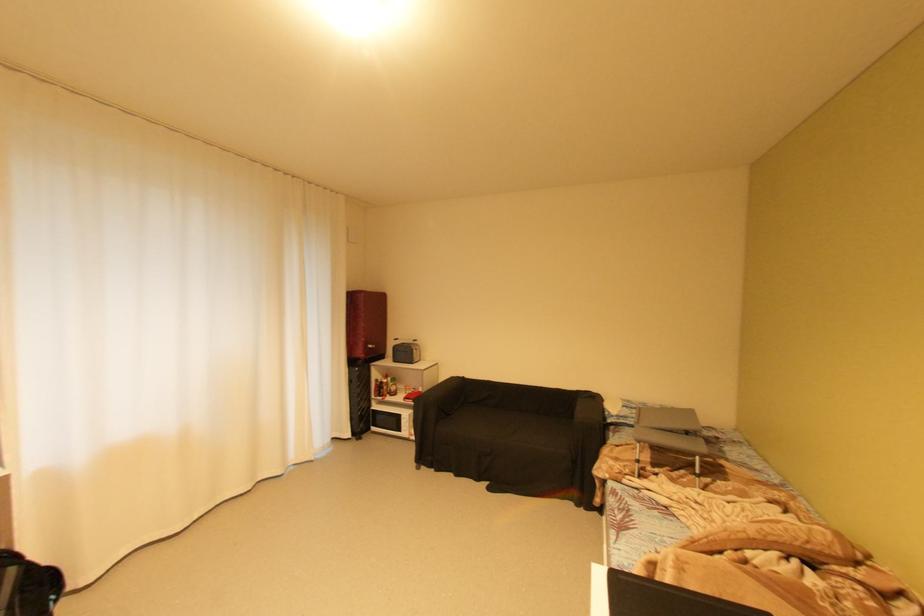
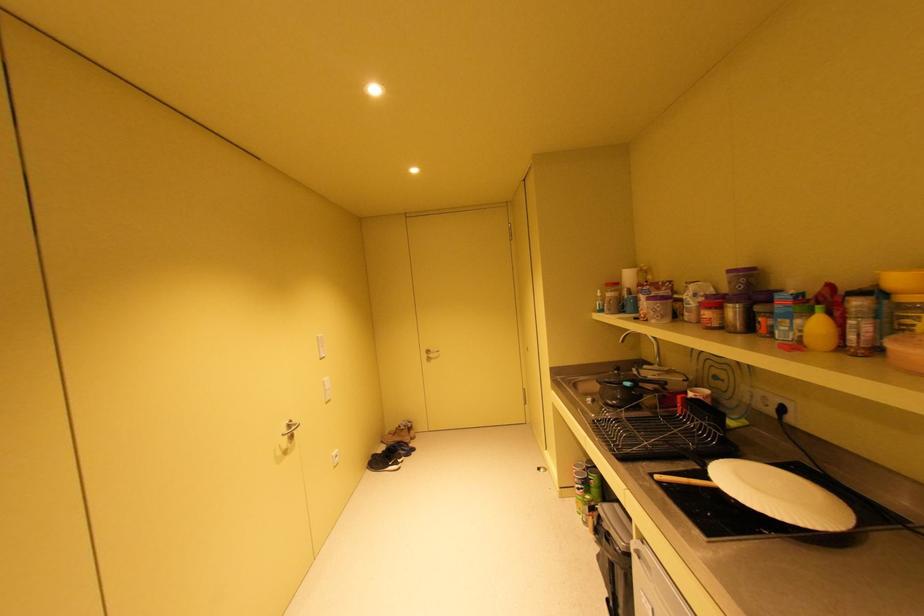
Question: The first image is from the beginning of the video and the second image is from the end. How did the camera likely rotate when shooting the video?

Choices:
 (A) Left
 (B) Right
 (C) Up
 (D) Down

Answer: (B)